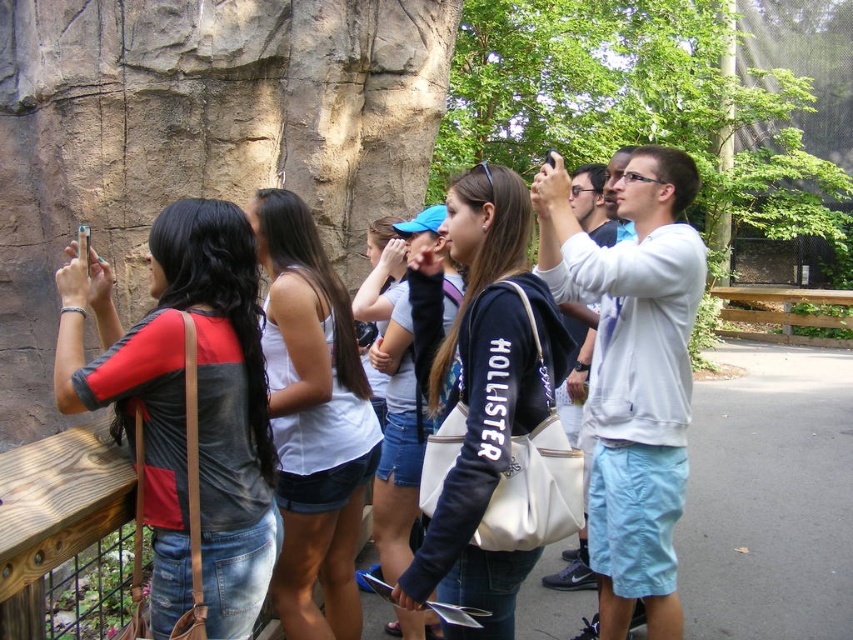
Who is lower down, white canvas bag at center or denim shorts at center?

white canvas bag at center

Who is positioned more to the left, white canvas bag at center or denim shorts at center?

denim shorts at center

Describe the element at coordinates (480, 388) in the screenshot. This screenshot has width=853, height=640. I see `white canvas bag at center` at that location.

You are a GUI agent. You are given a task and a screenshot of the screen. Output one action in this format:
    pyautogui.click(x=<x>, y=<y>)
    Task: Click on the white canvas bag at center
    
    Given the screenshot: What is the action you would take?
    pyautogui.click(x=480, y=388)

Can you confirm if white cotton hoodie at upper right is thinner than white matte tank top at center?

Incorrect, white cotton hoodie at upper right's width is not less than white matte tank top at center's.

Does white cotton hoodie at upper right have a greater height compared to white matte tank top at center?

Yes.

Does point (672, 556) come in front of point (281, 454)?

Yes, it is.

Where is `white cotton hoodie at upper right`? The image size is (853, 640). white cotton hoodie at upper right is located at coordinates (634, 374).

Who is lower down, white cotton hoodie at upper right or white canvas bag at center?

white canvas bag at center

Measure the distance between point (x=651, y=442) and camera.

Point (x=651, y=442) and camera are 15.40 meters apart from each other.

Between point (645, 186) and point (543, 298), which one is positioned in front?

Point (543, 298)

You are a GUI agent. You are given a task and a screenshot of the screen. Output one action in this format:
    pyautogui.click(x=<x>, y=<y>)
    Task: Click on the white cotton hoodie at upper right
    
    Given the screenshot: What is the action you would take?
    pyautogui.click(x=634, y=374)